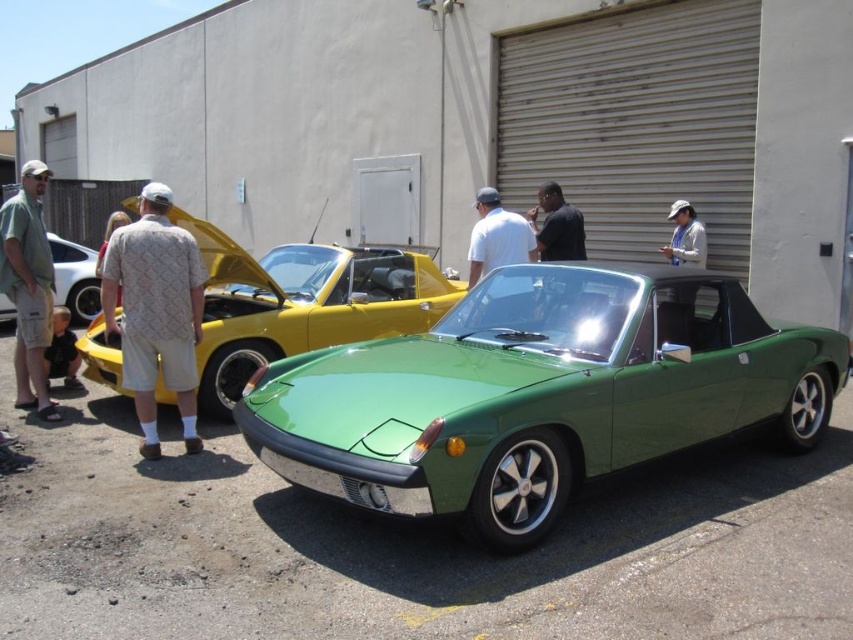
Question: Is green metallic car at center bigger than dark brown leather jacket at lower left?

Choices:
 (A) no
 (B) yes

Answer: (B)

Question: Can you confirm if green matte sports car at center is wider than green fabric shirt at left?

Choices:
 (A) yes
 (B) no

Answer: (B)

Question: Which of the following is the farthest from the observer?

Choices:
 (A) (549, 250)
 (B) (512, 406)
 (C) (51, 314)

Answer: (A)

Question: Which of the following is the farthest from the observer?

Choices:
 (A) green fabric shirt at left
 (B) dark brown leather jacket at lower left
 (C) white cotton shirt at center

Answer: (C)

Question: Based on their relative distances, which object is nearer to the dark brown leather jacket at lower left?

Choices:
 (A) green matte sports car at center
 (B) white cotton shirt at center

Answer: (A)

Question: Does matte yellow convertible at center appear on the left side of black matte shirt at center?

Choices:
 (A) no
 (B) yes

Answer: (B)